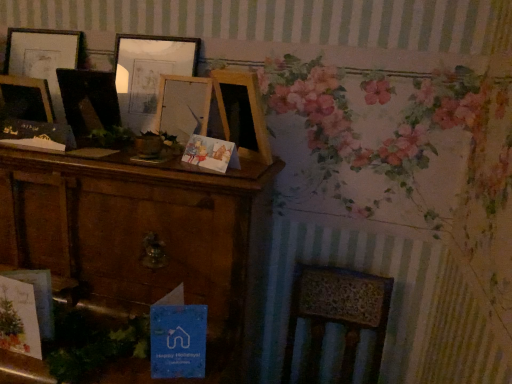
Question: Is wooden radiator at lower right bigger than blue paper postcard at lower center?

Choices:
 (A) no
 (B) yes

Answer: (B)

Question: Does wooden radiator at lower right lie behind blue paper postcard at lower center?

Choices:
 (A) no
 (B) yes

Answer: (A)

Question: Would you say wooden radiator at lower right is outside blue paper postcard at lower center?

Choices:
 (A) yes
 (B) no

Answer: (A)

Question: Can you confirm if wooden radiator at lower right is shorter than blue paper postcard at lower center?

Choices:
 (A) no
 (B) yes

Answer: (A)

Question: From a real-world perspective, is wooden radiator at lower right located beneath blue paper postcard at lower center?

Choices:
 (A) yes
 (B) no

Answer: (A)

Question: Is wooden radiator at lower right looking in the opposite direction of blue paper postcard at lower center?

Choices:
 (A) no
 (B) yes

Answer: (A)

Question: Is wooden picture frame at center, placed as the first picture frame when sorted from right to left, thinner than wooden radiator at lower right?

Choices:
 (A) no
 (B) yes

Answer: (B)

Question: Is wooden picture frame at center, which is the third picture frame in left-to-right order, positioned with its back to wooden radiator at lower right?

Choices:
 (A) no
 (B) yes

Answer: (A)

Question: Is wooden picture frame at center, which is the third picture frame in left-to-right order, further to camera compared to wooden radiator at lower right?

Choices:
 (A) no
 (B) yes

Answer: (B)

Question: Could you tell me if wooden picture frame at center, placed as the first picture frame when sorted from right to left, is turned towards wooden radiator at lower right?

Choices:
 (A) no
 (B) yes

Answer: (A)

Question: From the image's perspective, is wooden picture frame at center, which is the third picture frame in left-to-right order, located above wooden radiator at lower right?

Choices:
 (A) yes
 (B) no

Answer: (A)

Question: Is wooden picture frame at center, placed as the first picture frame when sorted from right to left, in front of wooden radiator at lower right?

Choices:
 (A) no
 (B) yes

Answer: (A)

Question: Is the position of blue paper postcard at lower center more distant than that of wooden picture frame at center, which is the third picture frame in left-to-right order?

Choices:
 (A) no
 (B) yes

Answer: (A)